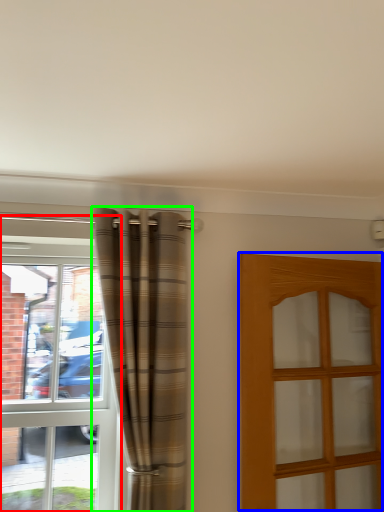
Question: Based on their relative distances, which object is farther from window (highlighted by a red box)? Choose from door (highlighted by a blue box) and curtain (highlighted by a green box).

Choices:
 (A) door
 (B) curtain

Answer: (A)